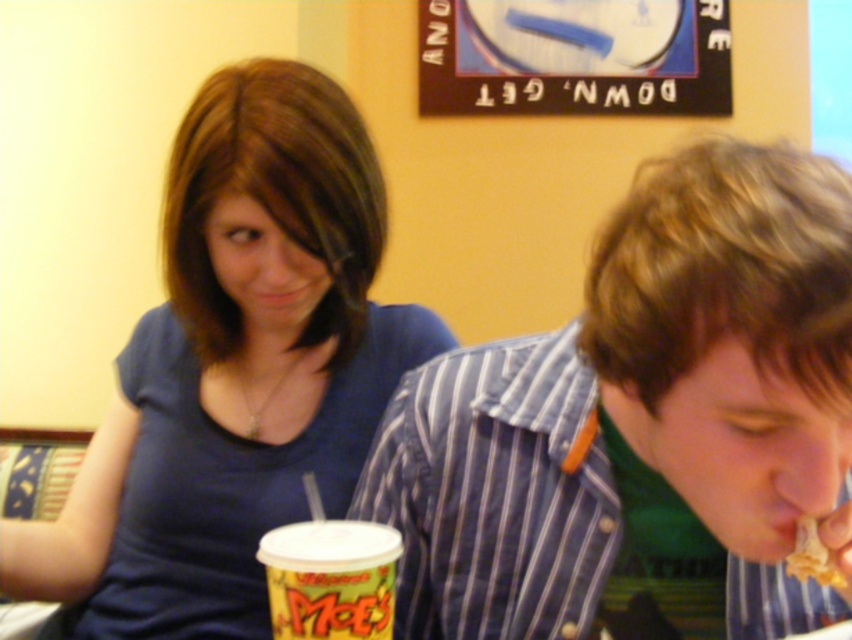
Question: Does striped cotton shirt at right have a greater width compared to yellowish-brown crispy snack at lower right?

Choices:
 (A) no
 (B) yes

Answer: (B)

Question: From the image, what is the correct spatial relationship of matte blue shirt at upper left in relation to yellowish-brown crispy snack at lower right?

Choices:
 (A) left
 (B) right

Answer: (A)

Question: Which point is farther to the camera?

Choices:
 (A) striped cotton shirt at right
 (B) yellowish-brown crispy snack at lower right

Answer: (B)

Question: Is matte blue shirt at upper left to the right of yellowish-brown crispy snack at lower right from the viewer's perspective?

Choices:
 (A) no
 (B) yes

Answer: (A)

Question: Which of these objects is positioned closest to the matte blue shirt at upper left?

Choices:
 (A) striped cotton shirt at right
 (B) yellow paper cup at lower center

Answer: (A)

Question: Among these points, which one is nearest to the camera?

Choices:
 (A) (329, 620)
 (B) (343, 115)
 (C) (793, 557)

Answer: (A)